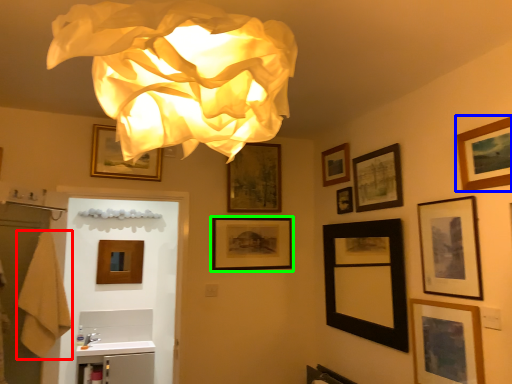
Question: Based on their relative distances, which object is nearer to bath towel (highlighted by a red box)? Choose from picture frame (highlighted by a blue box) and picture frame (highlighted by a green box).

Choices:
 (A) picture frame
 (B) picture frame

Answer: (B)